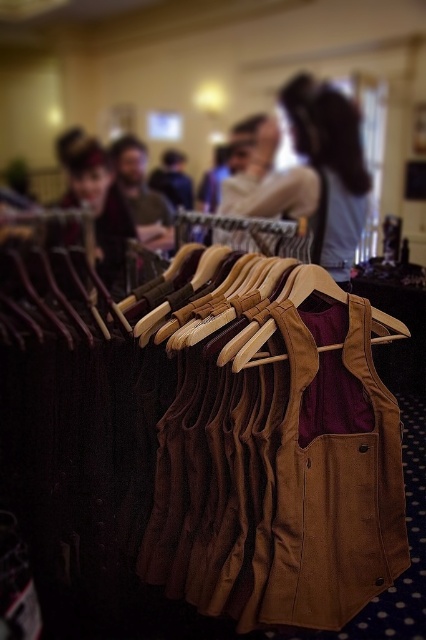
Is point (348, 147) farther from viewer compared to point (184, 189)?

Yes, it is.

Which of these two, light brown leather vest at center or brown suede vest at center, stands shorter?

brown suede vest at center is shorter.

The height and width of the screenshot is (640, 426). I want to click on light brown leather vest at center, so click(x=319, y=173).

Identify the location of light brown leather vest at center. (319, 173).

Between point (86, 148) and point (155, 177), which one is positioned behind?

The point (155, 177) is behind.

Image resolution: width=426 pixels, height=640 pixels. I want to click on velvet burgundy vest at center, so click(97, 198).

Can you confirm if light brown leather vest at center is bigger than velvet burgundy vest at center?

Yes.

Between point (299, 138) and point (80, 179), which one is positioned behind?

Positioned behind is point (299, 138).

The width and height of the screenshot is (426, 640). I want to click on light brown leather vest at center, so click(319, 173).